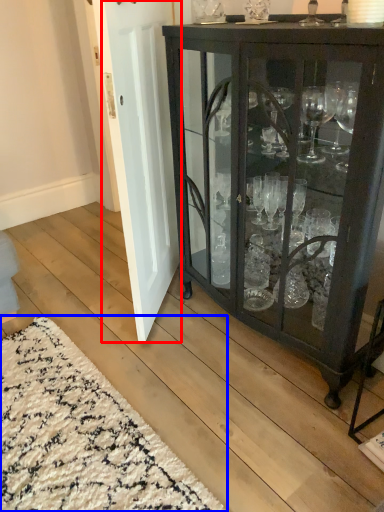
Question: Which object appears farthest to the camera in this image, door (highlighted by a red box) or doormat (highlighted by a blue box)?

Choices:
 (A) door
 (B) doormat

Answer: (A)